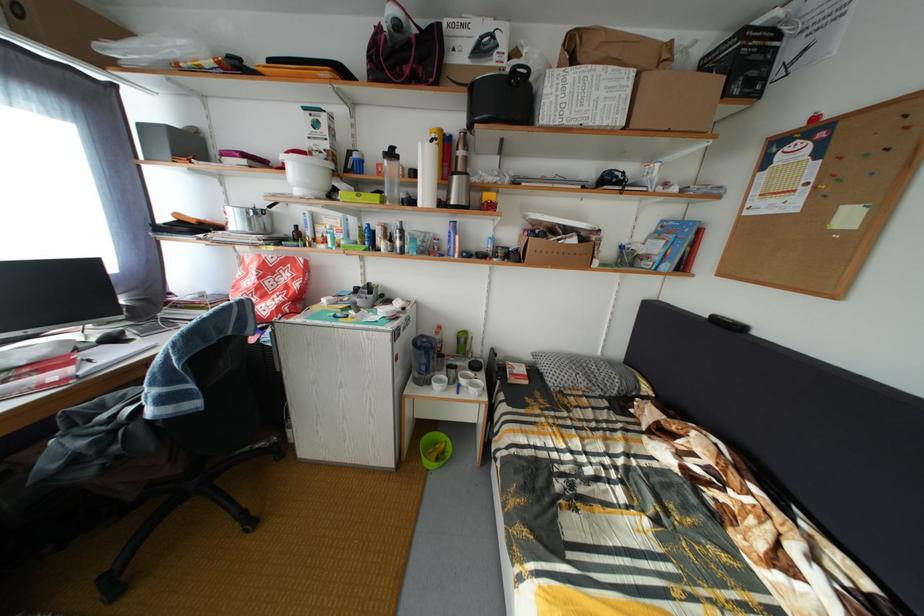
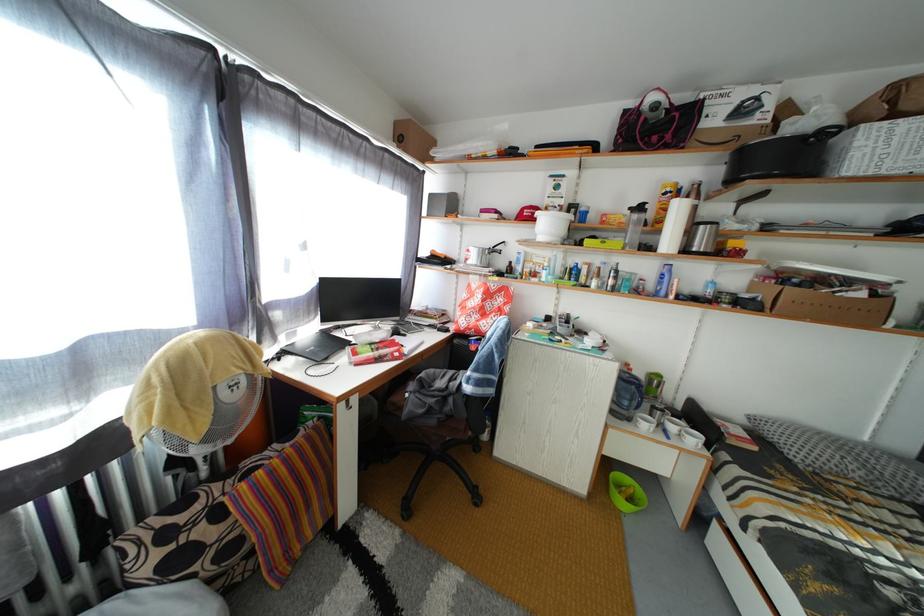
Question: The images are taken continuously from a first-person perspective. In which direction is your viewpoint rotating?

Choices:
 (A) Left
 (B) Right
 (C) Up
 (D) Down

Answer: (A)